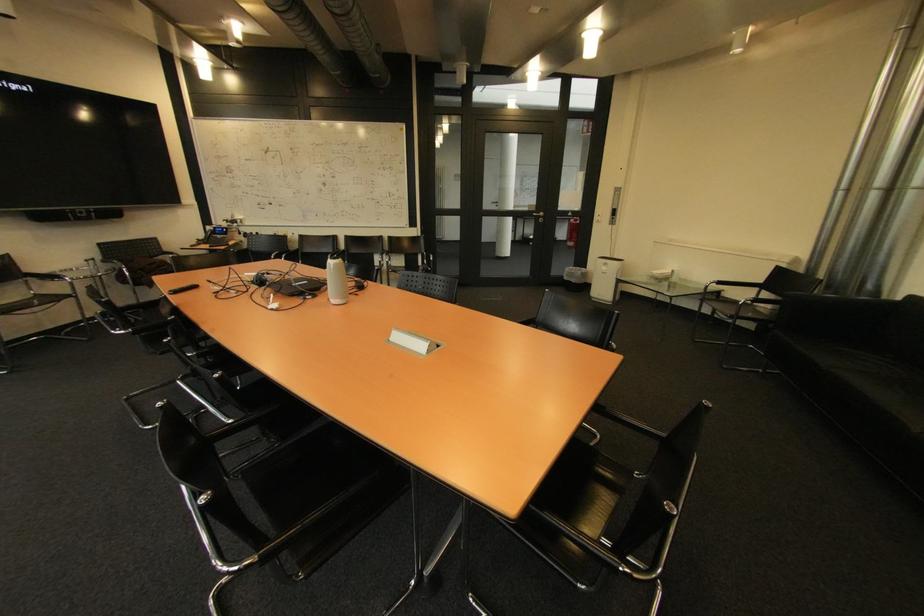
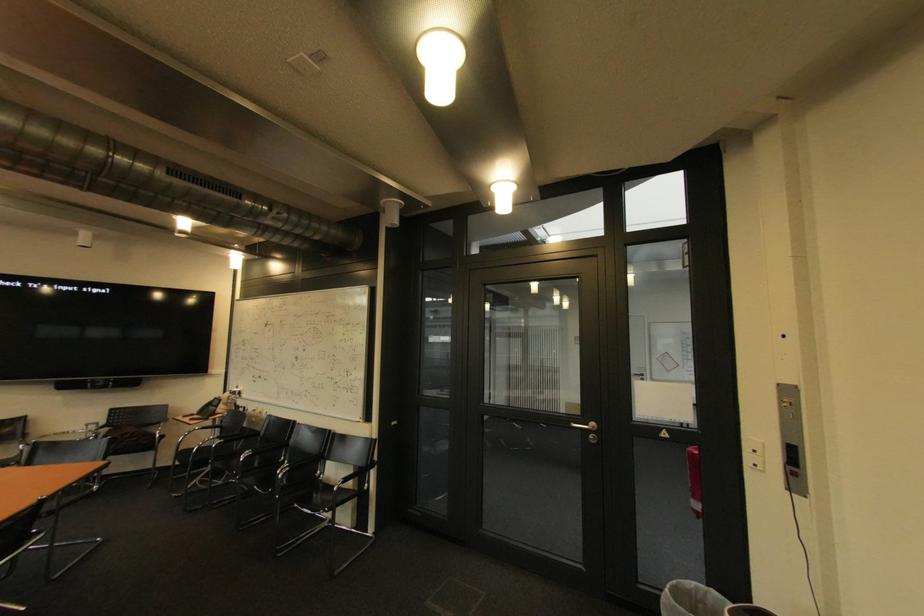
Find the pixel in the second image that matches (x=579, y=269) in the first image.

(701, 585)